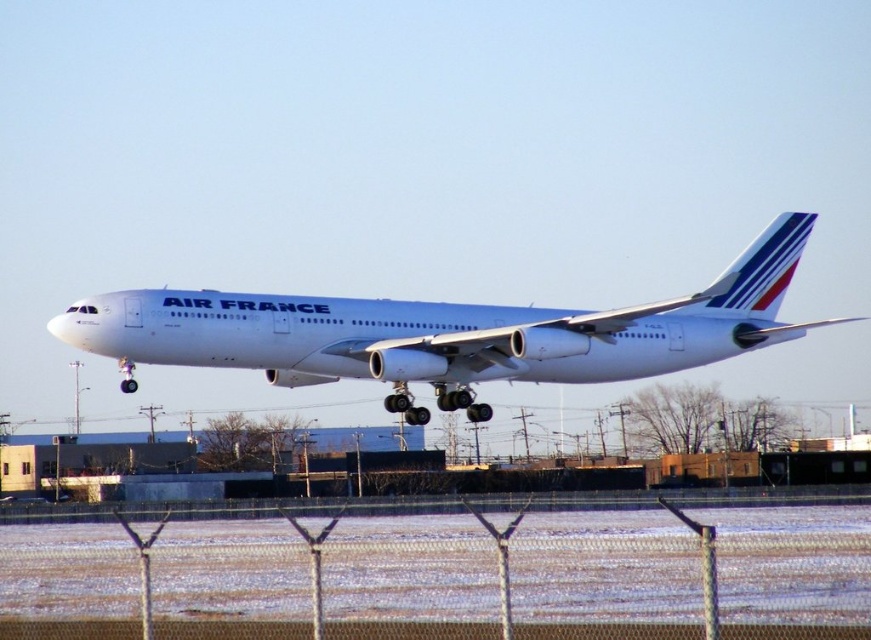
Question: Among these objects, which one is farthest from the camera?

Choices:
 (A) metallic chain-link fence at lower center
 (B) white metallic airplane at center

Answer: (B)

Question: Which of the following is the closest to the observer?

Choices:
 (A) metallic chain-link fence at lower center
 (B) white metallic airplane at center

Answer: (A)

Question: Does metallic chain-link fence at lower center appear under white metallic airplane at center?

Choices:
 (A) yes
 (B) no

Answer: (A)

Question: Does metallic chain-link fence at lower center have a lesser width compared to white metallic airplane at center?

Choices:
 (A) no
 (B) yes

Answer: (B)

Question: Can you confirm if metallic chain-link fence at lower center is smaller than white metallic airplane at center?

Choices:
 (A) no
 (B) yes

Answer: (B)

Question: Which of the following is the closest to the observer?

Choices:
 (A) (139, 333)
 (B) (802, 595)

Answer: (B)